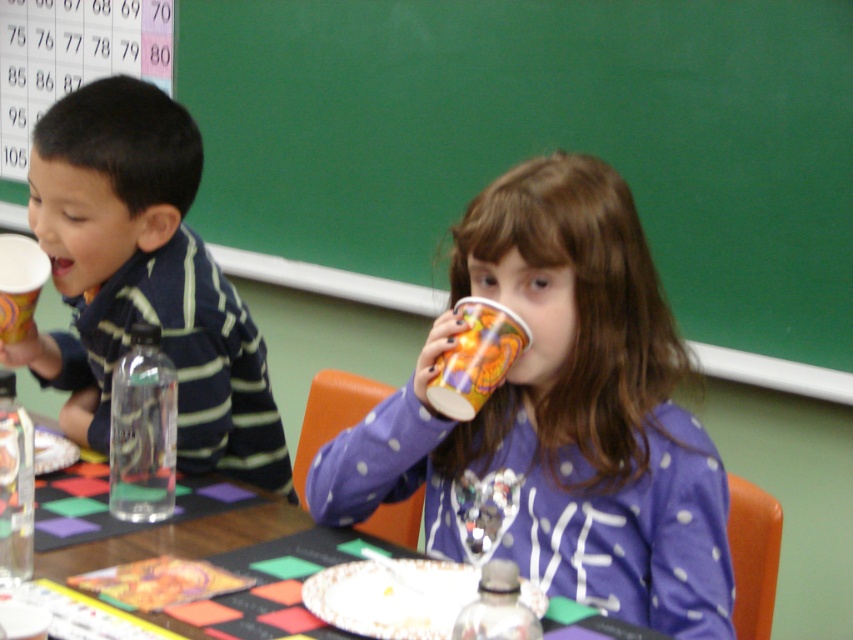
You are a teacher observing the classroom scene. You notice the matte black shirt at left and the transparent plastic bottle at center. Which object is wider?

The matte black shirt at left is wider than the transparent plastic bottle at center.

You are a teacher observing the classroom scene. You notice the wooden table at center and the clear plastic bottle at lower left. Which object has a smaller height?

The wooden table at center has a lesser height compared to the clear plastic bottle at lower left, so the wooden table at center is smaller in height.

You are a teacher observing the classroom scene. You notice a point at coordinates (143, 280). What object is located at this point?

The point at coordinates (143, 280) is where the matte black shirt at left is located.